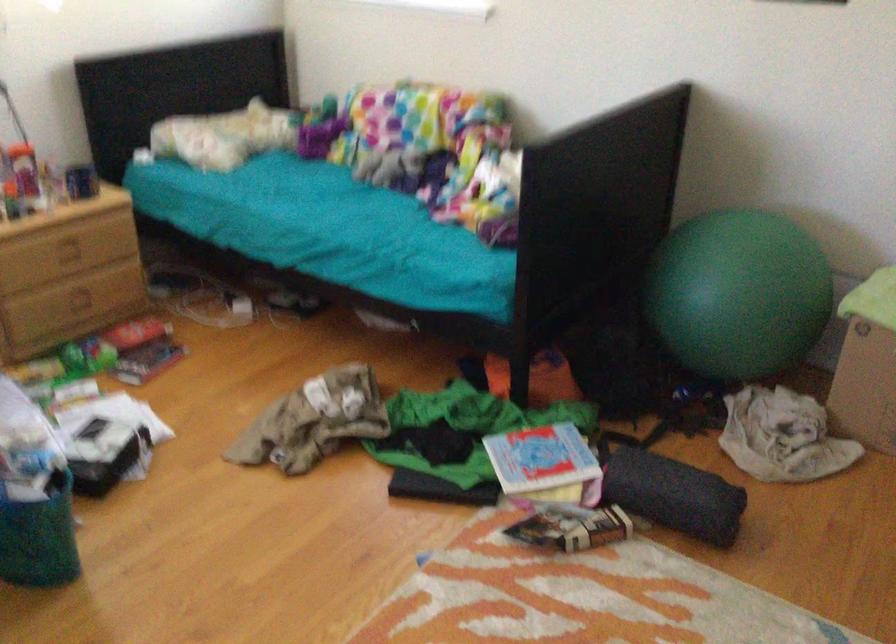
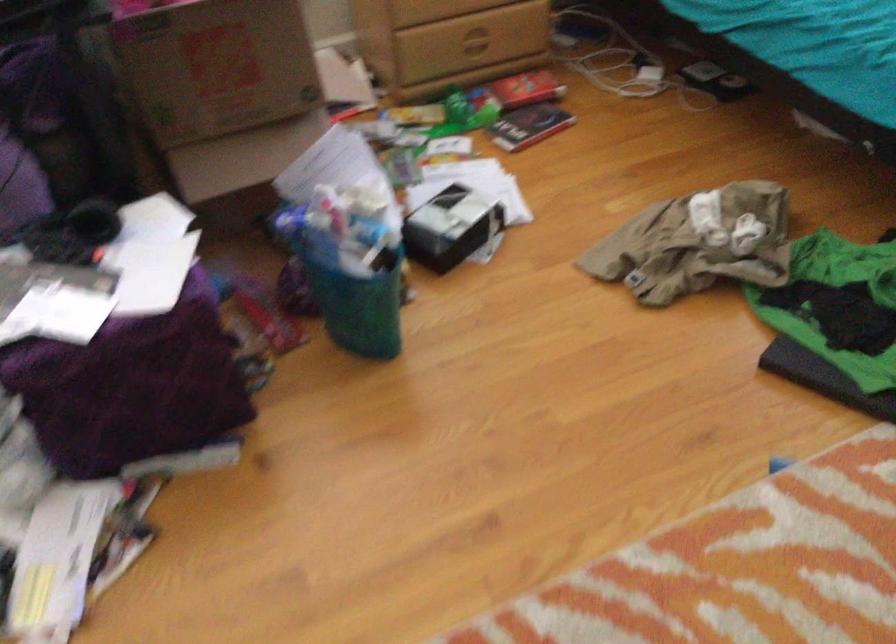
Locate, in the second image, the point that corresponds to [81,292] in the first image.

(472, 40)